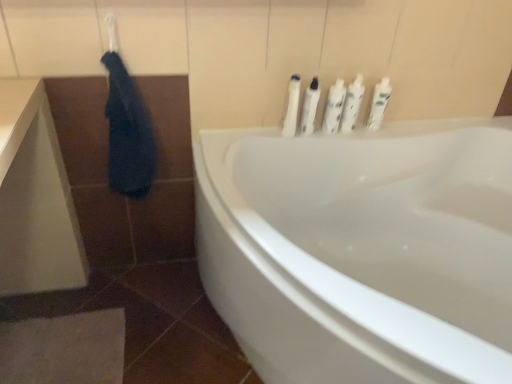
Where is `white plastic bottles at upper right, the fifth toiletry in the right-to-left sequence`? The width and height of the screenshot is (512, 384). white plastic bottles at upper right, the fifth toiletry in the right-to-left sequence is located at coordinates (291, 107).

Identify the location of white glossy bottles at upper center, positioned as the second toiletry in right-to-left order. (352, 104).

At what (x,y) coordinates should I click in order to perform the action: click on white glossy bottles at upper right, the first toiletry viewed from the right. Please return your answer as a coordinate pair (x, y). The height and width of the screenshot is (384, 512). Looking at the image, I should click on (379, 104).

Locate an element on the screen. This screenshot has width=512, height=384. white plastic bottles at upper right, the fifth toiletry in the right-to-left sequence is located at coordinates (291, 107).

Is white plastic bottles at upper center, positioned as the third toiletry in right-to-left order, to the left of white plastic bottles at upper right, the 1th toiletry viewed from the left, from the viewer's perspective?

No.

Is white plastic bottles at upper center, which is the third toiletry in left-to-right order, next to white plastic bottles at upper right, the fifth toiletry in the right-to-left sequence, and touching it?

No, white plastic bottles at upper center, which is the third toiletry in left-to-right order, is not making contact with white plastic bottles at upper right, the fifth toiletry in the right-to-left sequence.

From a real-world perspective, between white plastic bottles at upper center, positioned as the third toiletry in right-to-left order, and white plastic bottles at upper right, the fifth toiletry in the right-to-left sequence, who is vertically lower?

white plastic bottles at upper center, positioned as the third toiletry in right-to-left order, from a real-world perspective.

From the image's perspective, is white plastic bottles at upper center, which is the third toiletry in left-to-right order, below white plastic bottles at upper right, the 1th toiletry viewed from the left?

No.

Is white glossy bathtub at center facing towards dark blue fabric at upper left?

Yes, white glossy bathtub at center is turned towards dark blue fabric at upper left.

How many degrees apart are the facing directions of white glossy bathtub at center and dark blue fabric at upper left?

The facing directions of white glossy bathtub at center and dark blue fabric at upper left are 89.8 degrees apart.

From the image's perspective, is white glossy bathtub at center located above or below dark blue fabric at upper left?

Clearly, from the image's perspective, white glossy bathtub at center is below dark blue fabric at upper left.

Is point (109, 160) closer to viewer compared to point (401, 224)?

Yes, point (109, 160) is closer to viewer.

The width and height of the screenshot is (512, 384). What are the coordinates of `bathtub below the dark blue fabric at upper left (from a real-world perspective)` in the screenshot? It's located at (362, 250).

Between dark blue fabric at upper left and white glossy bathtub at center, which one appears on the left side from the viewer's perspective?

dark blue fabric at upper left.

Between white plastic bottles at upper center, positioned as the third toiletry in right-to-left order, and white glossy bathtub at center, which one has larger width?

With larger width is white glossy bathtub at center.

From the image's perspective, count 3rd toiletrys upward from the white glossy bathtub at center and point to it. Please provide its 2D coordinates.

[(334, 107)]

Does point (339, 99) come in front of point (336, 295)?

That is False.

Is white glossy bathtub at center oriented towards white glossy bottles at upper center, positioned as the second toiletry in right-to-left order?

No.

Can you see white glossy bathtub at center touching white glossy bottles at upper center, the fourth toiletry in the left-to-right sequence?

There is a gap between white glossy bathtub at center and white glossy bottles at upper center, the fourth toiletry in the left-to-right sequence.

In the scene shown: From the image's perspective, is white glossy bathtub at center located above white glossy bottles at upper center, positioned as the second toiletry in right-to-left order?

No, from the image's perspective, white glossy bathtub at center is not above white glossy bottles at upper center, positioned as the second toiletry in right-to-left order.

Between white glossy bathtub at center and white glossy bottles at upper center, positioned as the second toiletry in right-to-left order, which one has less height?

white glossy bottles at upper center, positioned as the second toiletry in right-to-left order, is shorter.

Consider the image. Can you confirm if white plastic bottles at upper center, which is the third toiletry in left-to-right order, is wider than white glossy bottles at upper center, the fourth toiletry in the left-to-right sequence?

Yes.

From a real-world perspective, is white plastic bottles at upper center, which is the third toiletry in left-to-right order, on white glossy bottles at upper center, the fourth toiletry in the left-to-right sequence?

Incorrect, from a real-world perspective, white plastic bottles at upper center, which is the third toiletry in left-to-right order, is lower than white glossy bottles at upper center, the fourth toiletry in the left-to-right sequence.

How much distance is there between white plastic bottles at upper center, positioned as the third toiletry in right-to-left order, and white glossy bottles at upper center, positioned as the second toiletry in right-to-left order?

white plastic bottles at upper center, positioned as the third toiletry in right-to-left order, is 4.92 centimeters away from white glossy bottles at upper center, positioned as the second toiletry in right-to-left order.

Can you see white plastic bottles at upper center, which is the third toiletry in left-to-right order, touching white glossy bottles at upper center, positioned as the second toiletry in right-to-left order?

Yes.

Is white glossy bottles at upper center, the fourth toiletry in the left-to-right sequence, completely or partially outside of white glossy bottles at upper right, the first toiletry viewed from the right?

Yes.

Based on their positions, is white glossy bottles at upper center, positioned as the second toiletry in right-to-left order, located to the left or right of white glossy bottles at upper right, the first toiletry viewed from the right?

In the image, white glossy bottles at upper center, positioned as the second toiletry in right-to-left order, appears on the left side of white glossy bottles at upper right, the first toiletry viewed from the right.

Is white glossy bottles at upper center, positioned as the second toiletry in right-to-left order, facing away from white glossy bottles at upper right, the first toiletry viewed from the right?

No, white glossy bottles at upper center, positioned as the second toiletry in right-to-left order,'s orientation is not away from white glossy bottles at upper right, the first toiletry viewed from the right.

Which object is further away from the camera taking this photo, white glossy bottles at upper center, positioned as the second toiletry in right-to-left order, or white glossy bottles at upper right, the fifth toiletry from the left?

white glossy bottles at upper right, the fifth toiletry from the left, is more distant.

This screenshot has height=384, width=512. In order to click on the 2nd toiletry behind the white plastic bottles at upper right, the fifth toiletry in the right-to-left sequence in this screenshot , I will do `click(334, 107)`.

At what (x,y) coordinates should I click in order to perform the action: click on bathtub lying below the dark blue fabric at upper left (from the image's perspective). Please return your answer as a coordinate pair (x, y). This screenshot has height=384, width=512. Looking at the image, I should click on (362, 250).

Looking at the image, which one is located closer to dark blue fabric at upper left, white glossy bathtub at center or white plastic bottles at upper right, the 1th toiletry viewed from the left?

white plastic bottles at upper right, the 1th toiletry viewed from the left, is positioned closer to the anchor dark blue fabric at upper left.

Considering their positions, is white plastic bottles at upper center, positioned as the third toiletry in right-to-left order, positioned further to white glossy bottles at upper center, arranged as the second toiletry when viewed from the left, than dark blue fabric at upper left?

Among the two, dark blue fabric at upper left is located further to white glossy bottles at upper center, arranged as the second toiletry when viewed from the left.

Which object lies further to the anchor point dark blue fabric at upper left, white plastic bottles at upper center, which is the third toiletry in left-to-right order, or white glossy bottles at upper center, arranged as the fourth toiletry when viewed from the right?

white plastic bottles at upper center, which is the third toiletry in left-to-right order, is positioned further to the anchor dark blue fabric at upper left.

From the image, which object appears to be nearer to white plastic bottles at upper center, positioned as the third toiletry in right-to-left order, white glossy bathtub at center or white plastic bottles at upper right, the fifth toiletry in the right-to-left sequence?

Based on the image, white plastic bottles at upper right, the fifth toiletry in the right-to-left sequence, appears to be nearer to white plastic bottles at upper center, positioned as the third toiletry in right-to-left order.

When comparing their distances from white glossy bottles at upper center, arranged as the fourth toiletry when viewed from the right, does white glossy bottles at upper right, the fifth toiletry from the left, or dark blue fabric at upper left seem further?

dark blue fabric at upper left is positioned further to the anchor white glossy bottles at upper center, arranged as the fourth toiletry when viewed from the right.

Based on their spatial positions, is white glossy bottles at upper right, the first toiletry viewed from the right, or white glossy bottles at upper center, arranged as the second toiletry when viewed from the left, further from white plastic bottles at upper center, which is the third toiletry in left-to-right order?

Among the two, white glossy bottles at upper right, the first toiletry viewed from the right, is located further to white plastic bottles at upper center, which is the third toiletry in left-to-right order.

Estimate the real-world distances between objects in this image. Which object is closer to white plastic bottles at upper right, the 1th toiletry viewed from the left, white plastic bottles at upper center, which is the third toiletry in left-to-right order, or white glossy bathtub at center?

white plastic bottles at upper center, which is the third toiletry in left-to-right order, is closer to white plastic bottles at upper right, the 1th toiletry viewed from the left.

Estimate the real-world distances between objects in this image. Which object is closer to white plastic bottles at upper center, positioned as the third toiletry in right-to-left order, white glossy bottles at upper right, the fifth toiletry from the left, or dark blue fabric at upper left?

white glossy bottles at upper right, the fifth toiletry from the left.

Identify the location of toiletry located between white plastic bottles at upper right, the 1th toiletry viewed from the left, and white plastic bottles at upper center, which is the third toiletry in left-to-right order, in the left-right direction. (310, 107).

This screenshot has width=512, height=384. Identify the location of toiletry between white glossy bottles at upper center, arranged as the fourth toiletry when viewed from the right, and white glossy bottles at upper center, the fourth toiletry in the left-to-right sequence. (334, 107).

You are a GUI agent. You are given a task and a screenshot of the screen. Output one action in this format:
    pyautogui.click(x=<x>, y=<y>)
    Task: Click on the toiletry situated between dark blue fabric at upper left and white glossy bottles at upper center, arranged as the fourth toiletry when viewed from the right, from left to right
    This screenshot has height=384, width=512.
    Given the screenshot: What is the action you would take?
    pyautogui.click(x=291, y=107)

The width and height of the screenshot is (512, 384). I want to click on toiletry between white glossy bathtub at center and white glossy bottles at upper center, arranged as the second toiletry when viewed from the left, from front to back, so click(x=291, y=107).